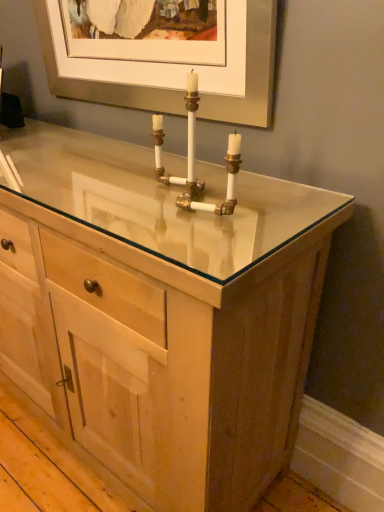
The height and width of the screenshot is (512, 384). What do you see at coordinates (160, 313) in the screenshot?
I see `natural wood cabinet at center` at bounding box center [160, 313].

Find the location of a particular element. The height and width of the screenshot is (512, 384). natural wood cabinet at center is located at coordinates (160, 313).

What is the approximate width of white brass pipe at center?

white brass pipe at center is 5.21 inches wide.

At what (x,y) coordinates should I click in order to perform the action: click on white brass pipe at center. Please return your answer as a coordinate pair (x, y). Looking at the image, I should click on (194, 159).

In order to face white brass pipe at center, should I rotate leftwards or rightwards?

Rotate your view left by about 0.511°.

The width and height of the screenshot is (384, 512). What do you see at coordinates (194, 159) in the screenshot?
I see `white brass pipe at center` at bounding box center [194, 159].

Image resolution: width=384 pixels, height=512 pixels. What are the coordinates of `natural wood cabinet at center` in the screenshot? It's located at (160, 313).

Which object is positioned more to the left, white brass pipe at center or natural wood cabinet at center?

natural wood cabinet at center.

Considering their positions, is white brass pipe at center located in front of or behind natural wood cabinet at center?

Clearly, white brass pipe at center is behind natural wood cabinet at center.

Is point (234, 157) closer or farther from the camera than point (174, 348)?

Point (234, 157) appears to be farther away from the viewer than point (174, 348).

From the image's perspective, which one is positioned lower, white brass pipe at center or natural wood cabinet at center?

natural wood cabinet at center is shown below in the image.

From a real-world perspective, who is located higher, white brass pipe at center or natural wood cabinet at center?

From a 3D spatial view, white brass pipe at center is above.

In terms of width, does white brass pipe at center look wider or thinner when compared to natural wood cabinet at center?

In the image, white brass pipe at center appears to be more narrow than natural wood cabinet at center.

From their relative heights in the image, would you say white brass pipe at center is taller or shorter than natural wood cabinet at center?

Considering their sizes, white brass pipe at center has less height than natural wood cabinet at center.

Based on the photo, is white brass pipe at center smaller than natural wood cabinet at center?

Yes.

Does white brass pipe at center contain natural wood cabinet at center?

No, natural wood cabinet at center is not inside white brass pipe at center.

Is white brass pipe at center next to natural wood cabinet at center?

No.

Is white brass pipe at center positioned with its back to natural wood cabinet at center?

No, white brass pipe at center is not facing away from natural wood cabinet at center.

Measure the distance from white brass pipe at center to natural wood cabinet at center.

white brass pipe at center and natural wood cabinet at center are 13.86 inches apart.

This screenshot has height=512, width=384. What are the coordinates of `the chest of drawers below the white brass pipe at center (from the image's perspective)` in the screenshot? It's located at (160, 313).

Considering the positions of objects natural wood cabinet at center and white brass pipe at center in the image provided, who is more to the left, natural wood cabinet at center or white brass pipe at center?

From the viewer's perspective, natural wood cabinet at center appears more on the left side.

Which is behind, natural wood cabinet at center or white brass pipe at center?

white brass pipe at center is behind.

Between point (30, 289) and point (193, 115), which one is positioned in front?

The point (193, 115) is closer.

From the image's perspective, is natural wood cabinet at center located above white brass pipe at center?

No, from the image's perspective, natural wood cabinet at center is not on top of white brass pipe at center.

From a real-world perspective, does natural wood cabinet at center sit lower than white brass pipe at center?

Yes, from a real-world perspective, natural wood cabinet at center is under white brass pipe at center.

Consider the image. Can you confirm if natural wood cabinet at center is wider than white brass pipe at center?

Yes.

Can you confirm if natural wood cabinet at center is shorter than white brass pipe at center?

No.

Between natural wood cabinet at center and white brass pipe at center, which one has smaller size?

Smaller between the two is white brass pipe at center.

Which is correct: natural wood cabinet at center is inside white brass pipe at center, or outside of it?

natural wood cabinet at center is outside white brass pipe at center.

Is natural wood cabinet at center not close to white brass pipe at center?

Actually, natural wood cabinet at center and white brass pipe at center are a little close together.

Is natural wood cabinet at center turned away from white brass pipe at center?

No.

The image size is (384, 512). Identify the location of candle holder located behind the natural wood cabinet at center. (194, 159).

This screenshot has width=384, height=512. In order to click on chest of drawers on the left of white brass pipe at center in this screenshot , I will do `click(160, 313)`.

Find the location of `candle holder above the natural wood cabinet at center (from a real-world perspective)`. candle holder above the natural wood cabinet at center (from a real-world perspective) is located at coordinates (194, 159).